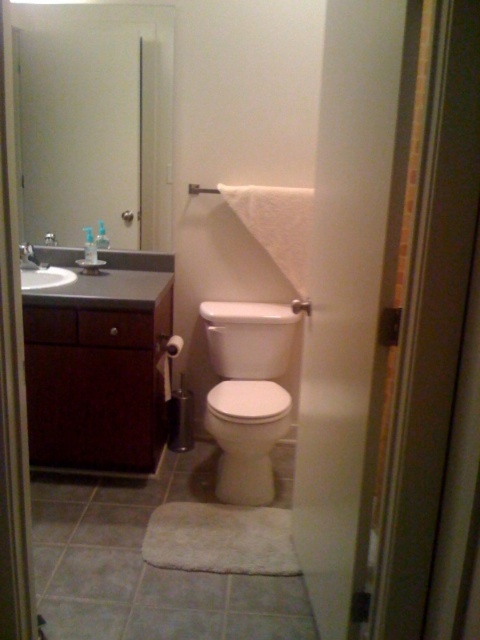
Is dark wood vanity at left bigger than matte white shower at center?

Yes.

Which is above, dark wood vanity at left or matte white shower at center?

matte white shower at center is above.

This screenshot has height=640, width=480. In order to click on dark wood vanity at left in this screenshot , I will do `click(97, 371)`.

Locate an element on the screen. This screenshot has width=480, height=640. dark wood vanity at left is located at coordinates (97, 371).

Image resolution: width=480 pixels, height=640 pixels. What do you see at coordinates (97, 371) in the screenshot? I see `dark wood vanity at left` at bounding box center [97, 371].

Looking at this image, is dark wood vanity at left wider than white glossy toilet at center?

Correct, the width of dark wood vanity at left exceeds that of white glossy toilet at center.

Does point (25, 305) come behind point (238, 385)?

That is False.

Find the location of a particular element. dark wood vanity at left is located at coordinates (97, 371).

Who is positioned more to the right, white glossy toilet at center or white glossy sink at upper left?

white glossy toilet at center

Can you confirm if white glossy toilet at center is taller than white glossy sink at upper left?

Indeed, white glossy toilet at center has a greater height compared to white glossy sink at upper left.

This screenshot has width=480, height=640. What do you see at coordinates (248, 394) in the screenshot?
I see `white glossy toilet at center` at bounding box center [248, 394].

Find the location of a particular element. This screenshot has width=480, height=640. white glossy toilet at center is located at coordinates (248, 394).